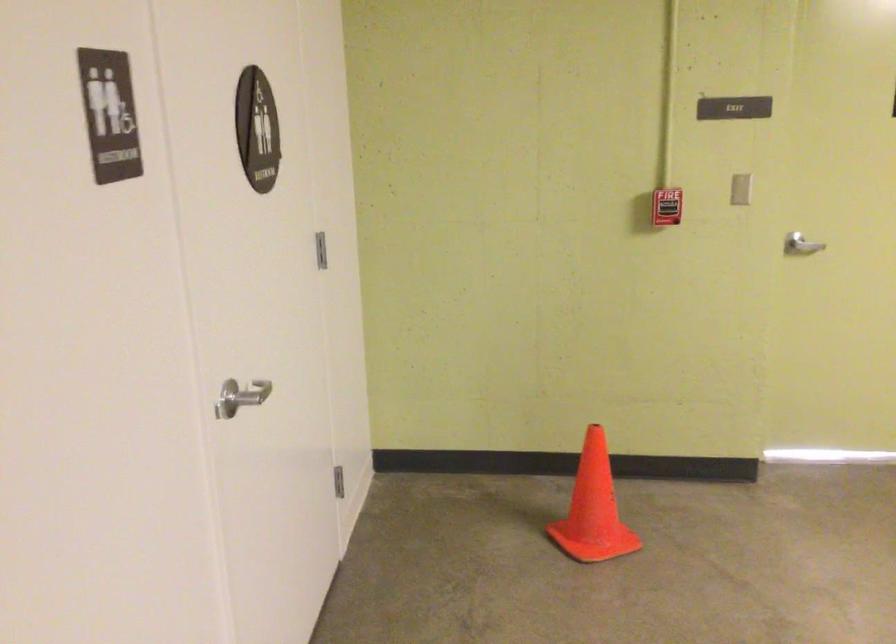
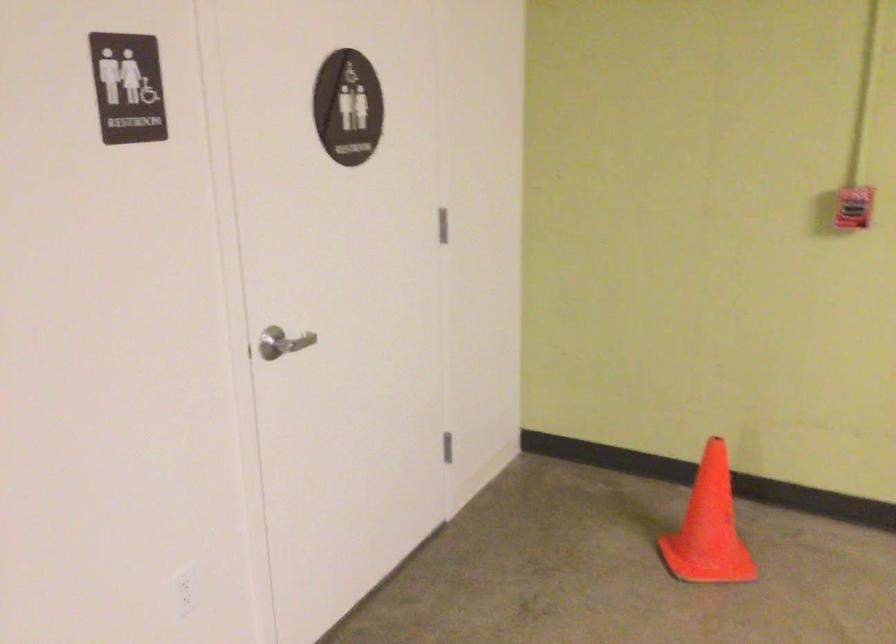
Locate, in the second image, the point that corresponds to pixel 675 205 in the first image.

(854, 207)